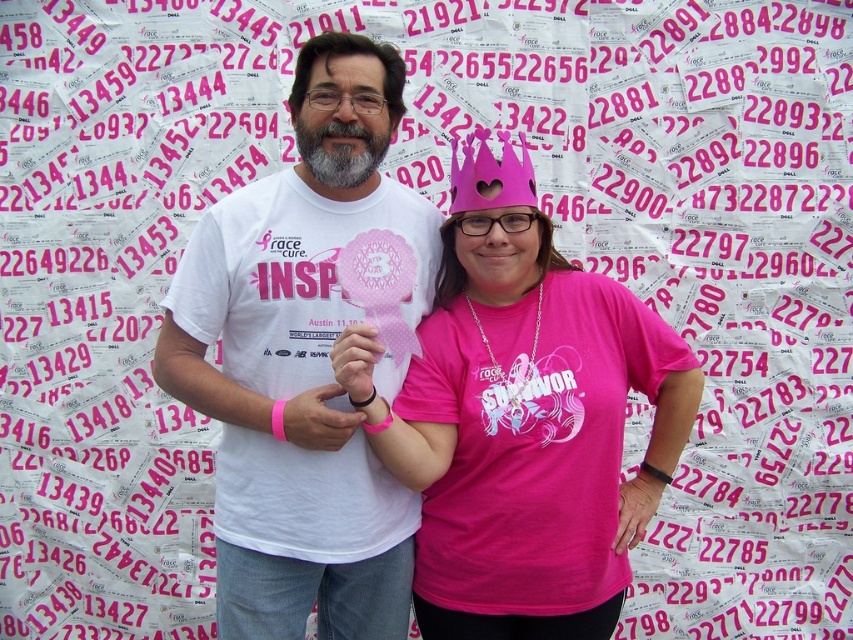
Is pink matte paper crown at center thinner than white matte t-shirt at center?

Incorrect, pink matte paper crown at center's width is not less than white matte t-shirt at center's.

Is point (585, 445) positioned before point (339, 104)?

That is True.

Image resolution: width=853 pixels, height=640 pixels. I want to click on pink matte paper crown at center, so click(521, 420).